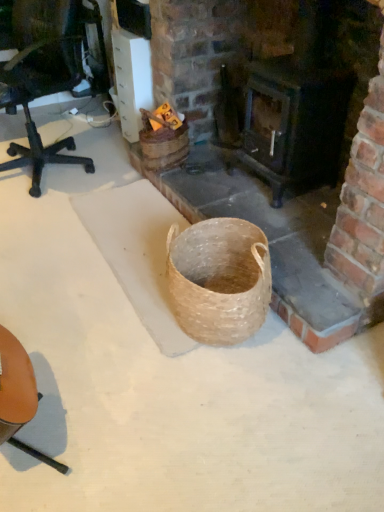
Question: Should I look upward or downward to see brown leather chair at lower left?

Choices:
 (A) up
 (B) down

Answer: (B)

Question: Is brick fireplace at center completely or partially inside brown leather chair at lower left?

Choices:
 (A) no
 (B) yes

Answer: (A)

Question: Is brown leather chair at lower left smaller than brick fireplace at center?

Choices:
 (A) no
 (B) yes

Answer: (B)

Question: Is brown leather chair at lower left oriented away from brick fireplace at center?

Choices:
 (A) yes
 (B) no

Answer: (A)

Question: Are brown leather chair at lower left and brick fireplace at center making contact?

Choices:
 (A) no
 (B) yes

Answer: (A)

Question: Is brown leather chair at lower left completely or partially outside of brick fireplace at center?

Choices:
 (A) no
 (B) yes

Answer: (B)

Question: Does brown leather chair at lower left have a greater height compared to brick fireplace at center?

Choices:
 (A) no
 (B) yes

Answer: (B)

Question: From the image's perspective, is dark wood stove at center located beneath brown leather chair at lower left?

Choices:
 (A) no
 (B) yes

Answer: (A)

Question: Considering the relative sizes of dark wood stove at center and brown leather chair at lower left in the image provided, is dark wood stove at center smaller than brown leather chair at lower left?

Choices:
 (A) yes
 (B) no

Answer: (B)

Question: Would you say dark wood stove at center contains brown leather chair at lower left?

Choices:
 (A) yes
 (B) no

Answer: (B)

Question: Does dark wood stove at center have a greater width compared to brown leather chair at lower left?

Choices:
 (A) no
 (B) yes

Answer: (B)

Question: Does dark wood stove at center turn towards brown leather chair at lower left?

Choices:
 (A) yes
 (B) no

Answer: (B)

Question: Does dark wood stove at center have a lesser width compared to brown leather chair at lower left?

Choices:
 (A) yes
 (B) no

Answer: (B)

Question: Is brick fireplace at center not inside brown leather chair at lower left?

Choices:
 (A) yes
 (B) no

Answer: (A)